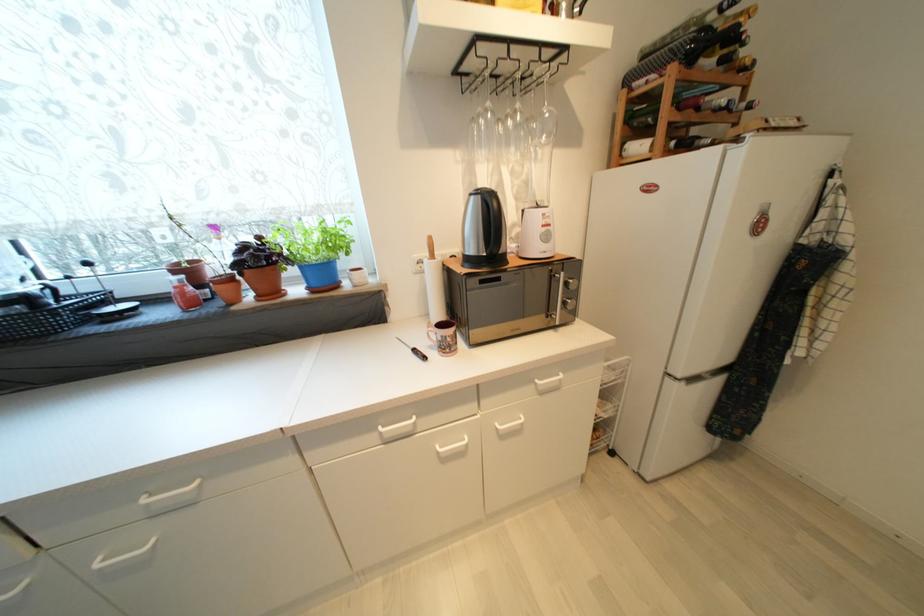
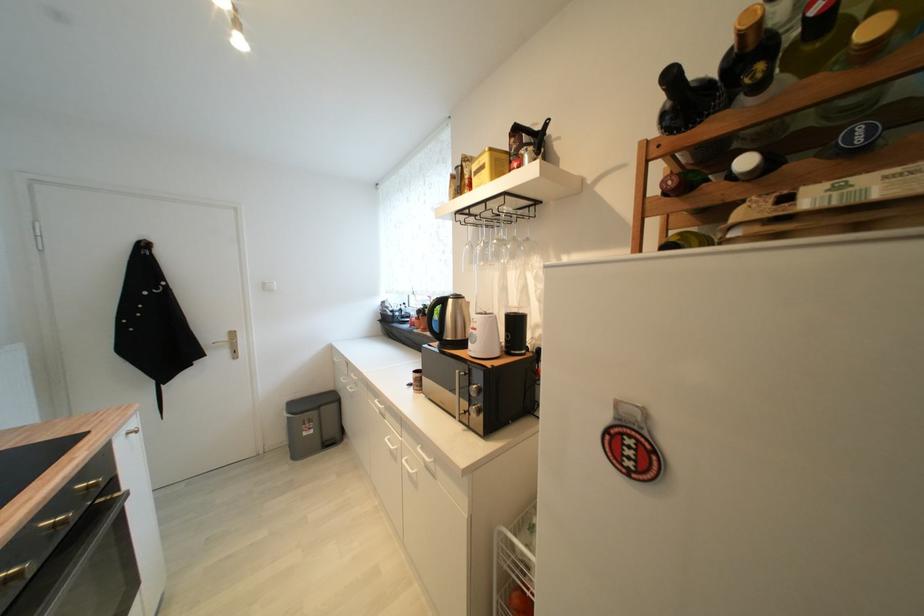
Locate, in the second image, the point that corresponds to pixel 249 249 in the first image.

(431, 309)